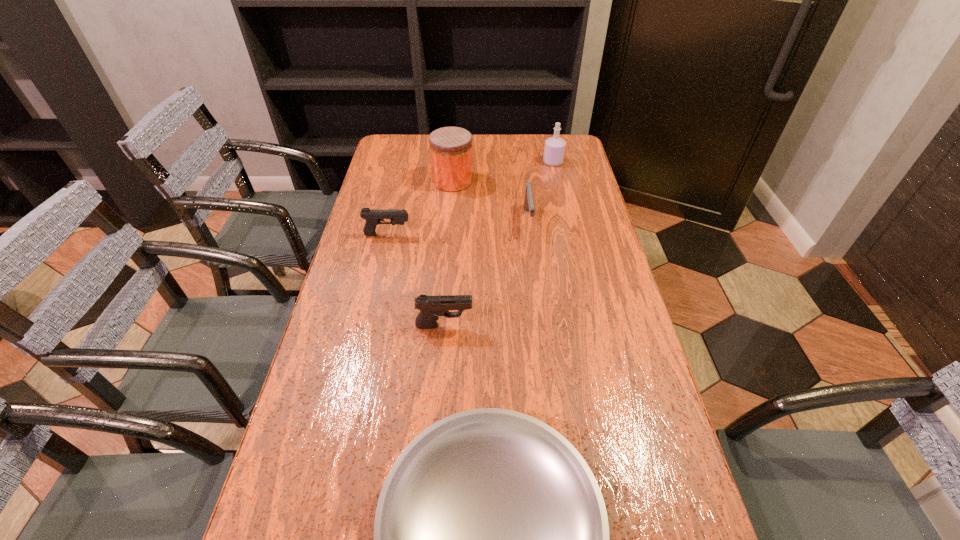
This screenshot has height=540, width=960. I want to click on vacant space located 0.180m at the barrel of the second pistol from left to right, so click(542, 325).

Identify the location of vacant area situated at the barrel of the leftmost pistol. (461, 235).

Find the location of a particular element. The height and width of the screenshot is (540, 960). object present at the far edge is located at coordinates (554, 150).

You are a GUI agent. You are given a task and a screenshot of the screen. Output one action in this format:
    pyautogui.click(x=<x>, y=<y>)
    Task: Click on the object at the left edge
    The width and height of the screenshot is (960, 540).
    Given the screenshot: What is the action you would take?
    pyautogui.click(x=373, y=217)

Where is `object that is at the right edge`? The image size is (960, 540). object that is at the right edge is located at coordinates (554, 150).

Where is `object present at the far right corner`? object present at the far right corner is located at coordinates (554, 150).

Image resolution: width=960 pixels, height=540 pixels. I want to click on vacant space at the far edge, so [507, 143].

Where is `free region at the left edge of the desktop`? free region at the left edge of the desktop is located at coordinates (291, 490).

Where is `blank space at the right edge`? Image resolution: width=960 pixels, height=540 pixels. blank space at the right edge is located at coordinates (546, 189).

You are a GUI agent. You are given a task and a screenshot of the screen. Output one action in this format:
    pyautogui.click(x=<x>, y=<y>)
    Task: Click on the free space at the far left corner of the desktop
    This screenshot has width=960, height=540.
    Given the screenshot: What is the action you would take?
    pyautogui.click(x=419, y=148)